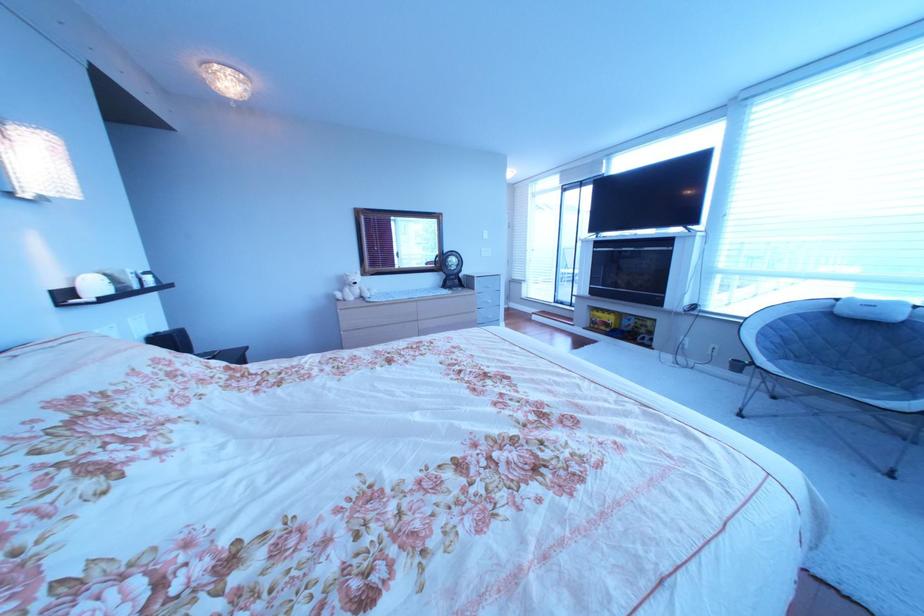
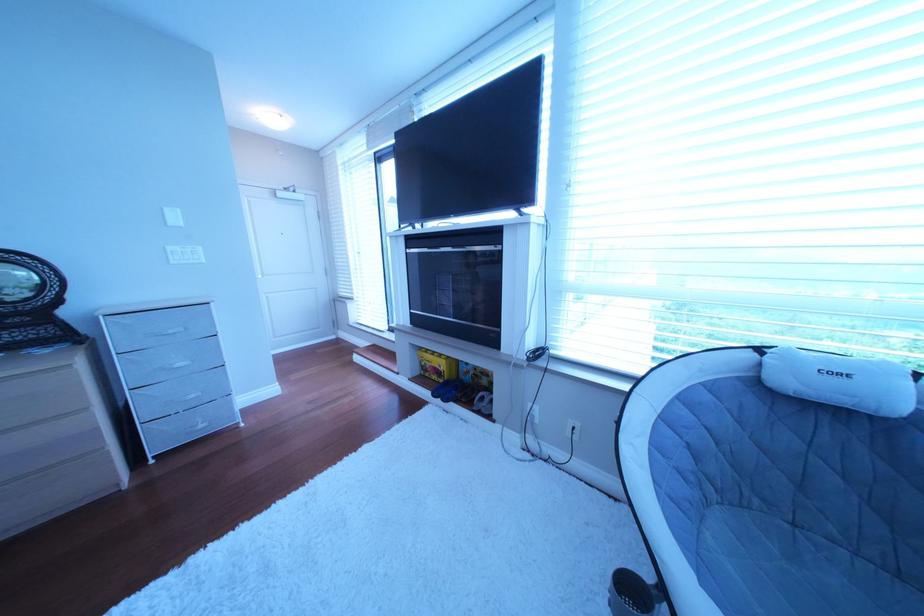
In the second image, find the point that corresponds to point 617,330 in the first image.

(450, 379)